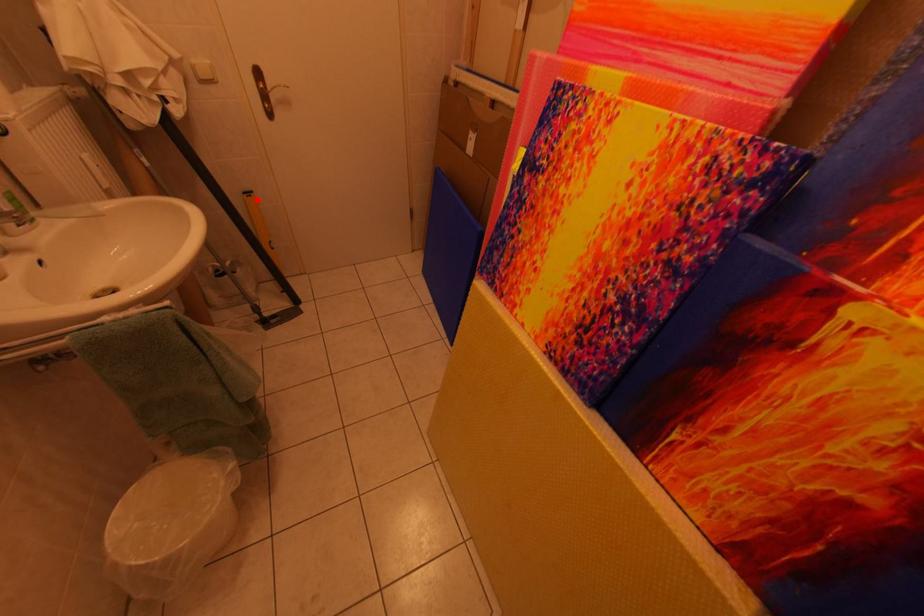
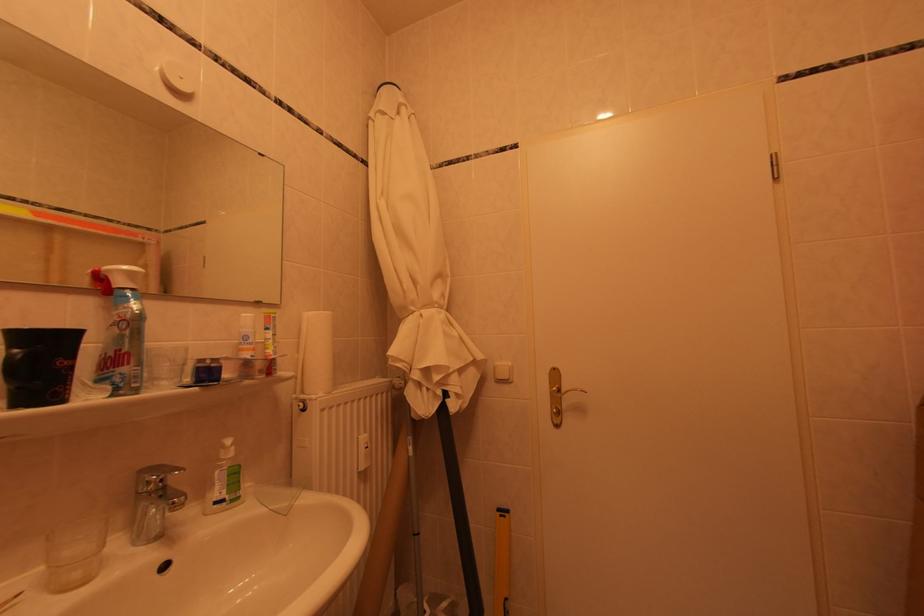
In the second image, find the point that corresponds to the highlighted location in the first image.

(509, 519)